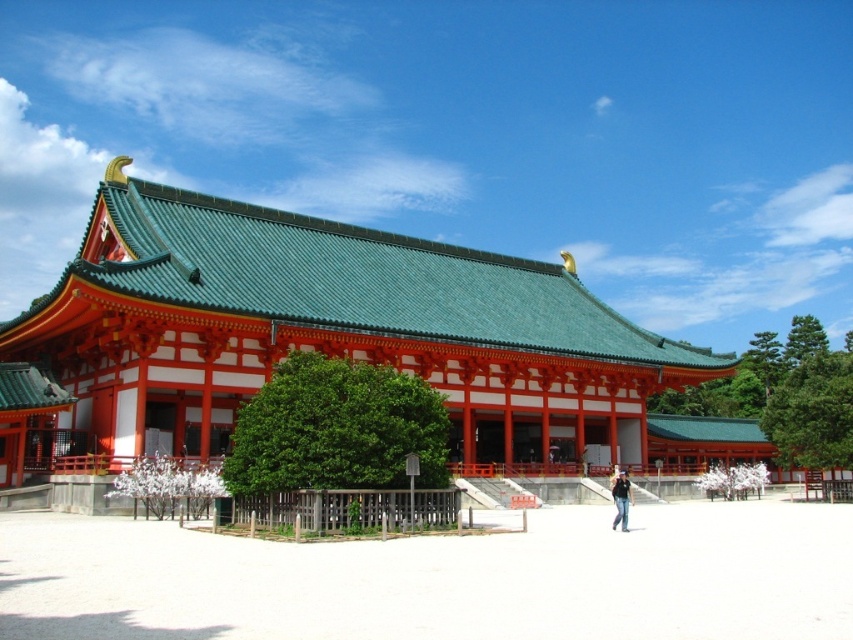
Who is higher up, green leafy tree at center or black denim jeans at lower center?

green leafy tree at center

Can you confirm if green leafy tree at center is positioned to the right of black denim jeans at lower center?

Incorrect, green leafy tree at center is not on the right side of black denim jeans at lower center.

Does point (286, 442) come farther from viewer compared to point (614, 490)?

No, it is not.

The image size is (853, 640). I want to click on green leafy tree at center, so click(338, 444).

Is point (251, 257) closer to viewer compared to point (247, 477)?

No.

Between matte red wooden temple at center and green leafy tree at center, which one is positioned lower?

Positioned lower is green leafy tree at center.

Between point (67, 356) and point (378, 483), which one is positioned in front?

Point (378, 483) is in front.

At what (x,y) coordinates should I click in order to perform the action: click on matte red wooden temple at center. Please return your answer as a coordinate pair (x, y). This screenshot has height=640, width=853. Looking at the image, I should click on (331, 332).

Is matte red wooden temple at center below green leafy tree at right?

Incorrect, matte red wooden temple at center is not positioned below green leafy tree at right.

Can you confirm if matte red wooden temple at center is wider than green leafy tree at right?

Indeed, matte red wooden temple at center has a greater width compared to green leafy tree at right.

Describe the element at coordinates (331, 332) in the screenshot. The image size is (853, 640). I see `matte red wooden temple at center` at that location.

Image resolution: width=853 pixels, height=640 pixels. I want to click on matte red wooden temple at center, so click(331, 332).